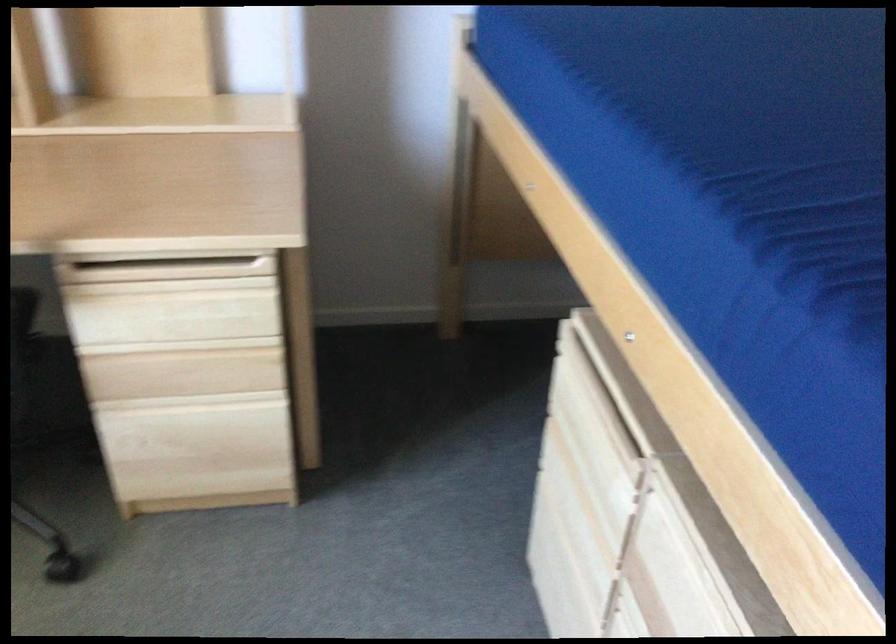
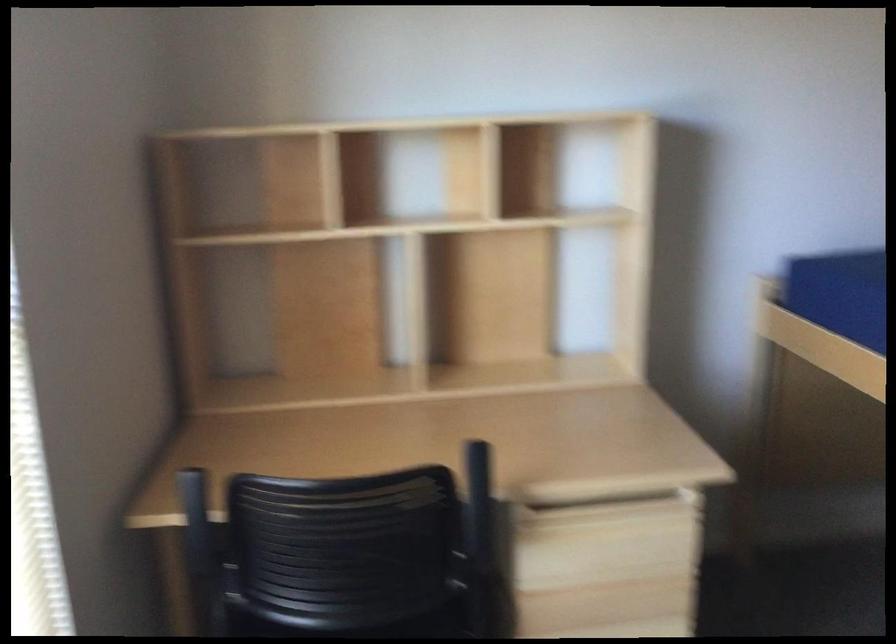
In the second image, find the point that corresponds to (182,279) in the first image.

(616, 520)